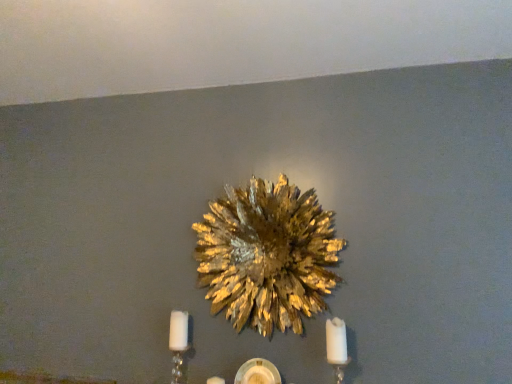
Question: Is white matte candle at lower right a part of white crystal candle holder at lower left?

Choices:
 (A) no
 (B) yes

Answer: (A)

Question: Considering the relative sizes of white crystal candle holder at lower left and white matte candle at lower right in the image provided, is white crystal candle holder at lower left bigger than white matte candle at lower right?

Choices:
 (A) no
 (B) yes

Answer: (A)

Question: From the image's perspective, is white crystal candle holder at lower left below white matte candle at lower right?

Choices:
 (A) yes
 (B) no

Answer: (A)

Question: Is white matte candle at lower right at the back of white crystal candle holder at lower left?

Choices:
 (A) no
 (B) yes

Answer: (A)

Question: Is the surface of white crystal candle holder at lower left in direct contact with white matte candle at lower right?

Choices:
 (A) yes
 (B) no

Answer: (B)

Question: Is white matte candle at lower right taller or shorter than white crystal candle holder at lower left?

Choices:
 (A) tall
 (B) short

Answer: (A)

Question: In terms of width, does white matte candle at lower right look wider or thinner when compared to white crystal candle holder at lower left?

Choices:
 (A) wide
 (B) thin

Answer: (A)

Question: Which is correct: white matte candle at lower right is inside white crystal candle holder at lower left, or outside of it?

Choices:
 (A) inside
 (B) outside

Answer: (B)

Question: Is point (335, 342) closer or farther from the camera than point (182, 380)?

Choices:
 (A) farther
 (B) closer

Answer: (B)

Question: From a real-world perspective, is gold metallic flower at center physically located above or below white crystal candle holder at lower left?

Choices:
 (A) above
 (B) below

Answer: (A)

Question: Is gold metallic flower at center in front of or behind white crystal candle holder at lower left in the image?

Choices:
 (A) behind
 (B) front

Answer: (B)

Question: Is gold metallic flower at center spatially inside white crystal candle holder at lower left, or outside of it?

Choices:
 (A) outside
 (B) inside

Answer: (A)

Question: From the image's perspective, is gold metallic flower at center located above or below white crystal candle holder at lower left?

Choices:
 (A) below
 (B) above

Answer: (B)

Question: From a real-world perspective, is gold metallic flower at center above or below white matte candle at lower right?

Choices:
 (A) above
 (B) below

Answer: (A)

Question: Is gold metallic flower at center bigger or smaller than white matte candle at lower right?

Choices:
 (A) big
 (B) small

Answer: (A)